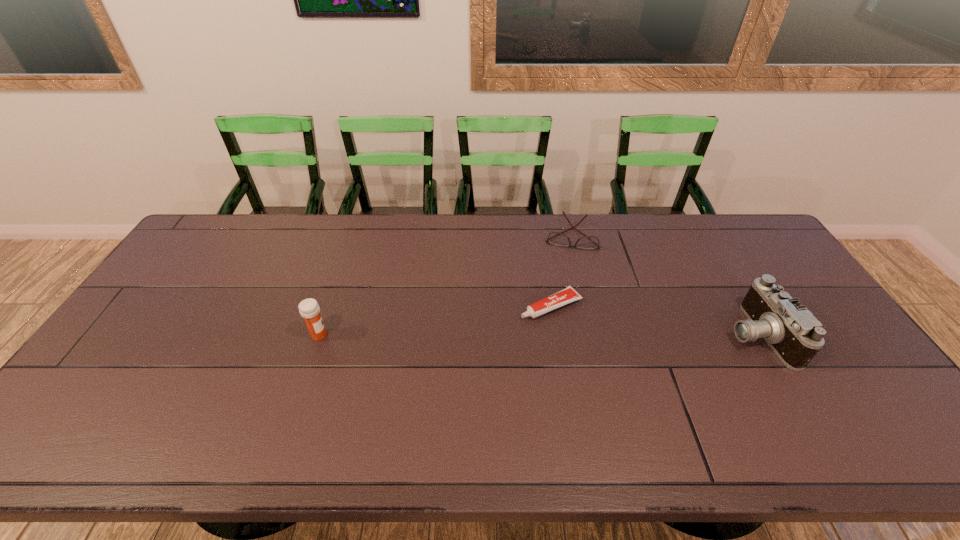
At what (x,y) coordinates should I click in order to perform the action: click on the leftmost object. Please return your answer as a coordinate pair (x, y). The width and height of the screenshot is (960, 540). Looking at the image, I should click on (309, 309).

You are a GUI agent. You are given a task and a screenshot of the screen. Output one action in this format:
    pyautogui.click(x=<x>, y=<y>)
    Task: Click on the rightmost object
    The image size is (960, 540).
    Given the screenshot: What is the action you would take?
    pyautogui.click(x=792, y=332)

The width and height of the screenshot is (960, 540). I want to click on toothpaste, so click(567, 295).

Find the location of a particular element. The height and width of the screenshot is (540, 960). spectacles is located at coordinates (555, 238).

Locate an element on the screen. The image size is (960, 540). the farthest object is located at coordinates (555, 238).

I want to click on vacant space situated 0.280m on the label side of the medicine, so click(x=428, y=335).

At what (x,y) coordinates should I click in order to perform the action: click on vacant area situated at the lens of the camera. Please return your answer as a coordinate pair (x, y). The image size is (960, 540). Looking at the image, I should click on pos(627,335).

Where is `vacant region located 0.200m at the lens of the camera`? vacant region located 0.200m at the lens of the camera is located at coordinates 655,335.

Find the location of a particular element. The width and height of the screenshot is (960, 540). vacant space situated 0.140m at the lens of the camera is located at coordinates click(677, 335).

At what (x,y) coordinates should I click in order to perform the action: click on free space located 0.170m at the nozzle of the shortest object. Please return your answer as a coordinate pair (x, y). Looking at the image, I should click on (474, 336).